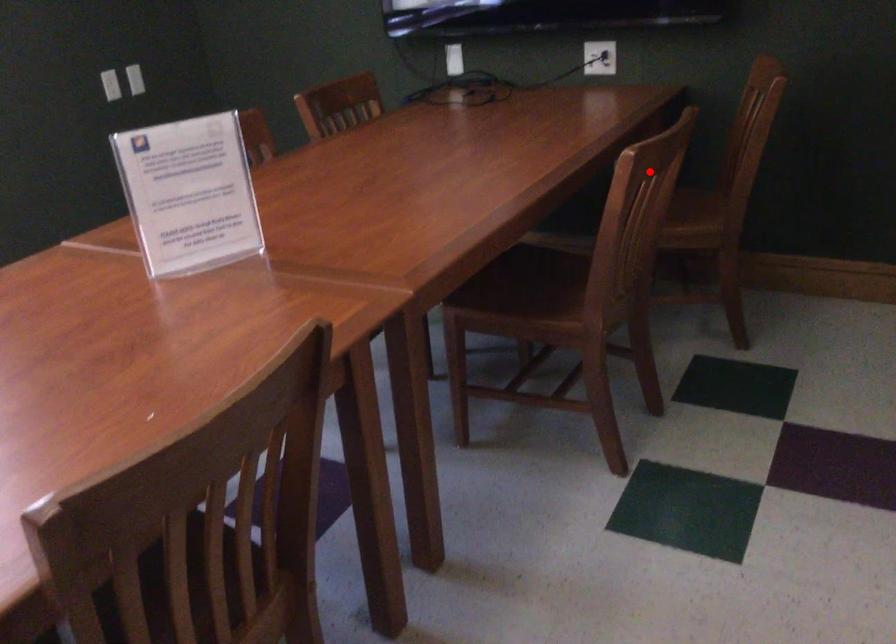
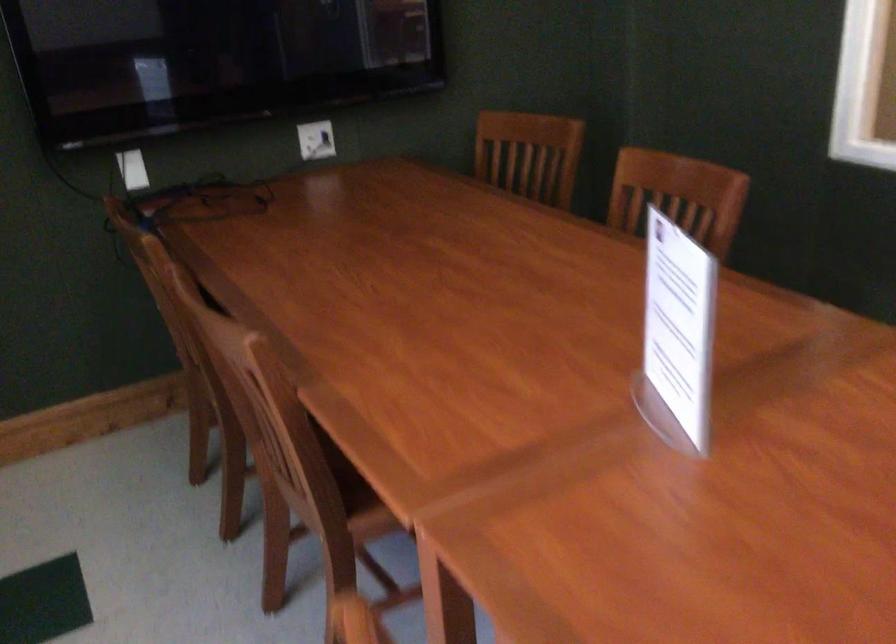
Locate, in the second image, the point that corresponds to the highlighted location in the first image.

(677, 196)